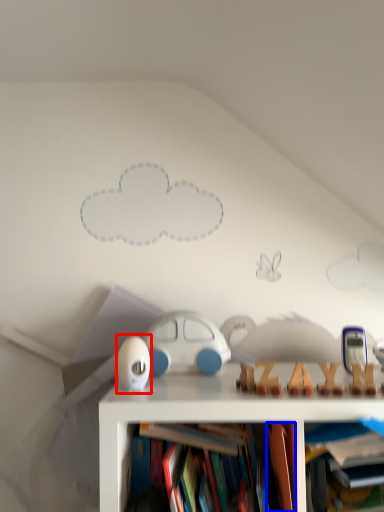
Question: Among these objects, which one is farthest to the camera, toy (highlighted by a red box) or book (highlighted by a blue box)?

Choices:
 (A) toy
 (B) book

Answer: (A)